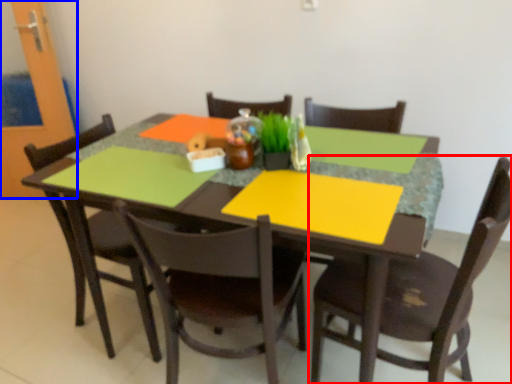
Question: Which of the following is the farthest to the observer, chair (highlighted by a red box) or glass door (highlighted by a blue box)?

Choices:
 (A) chair
 (B) glass door

Answer: (B)